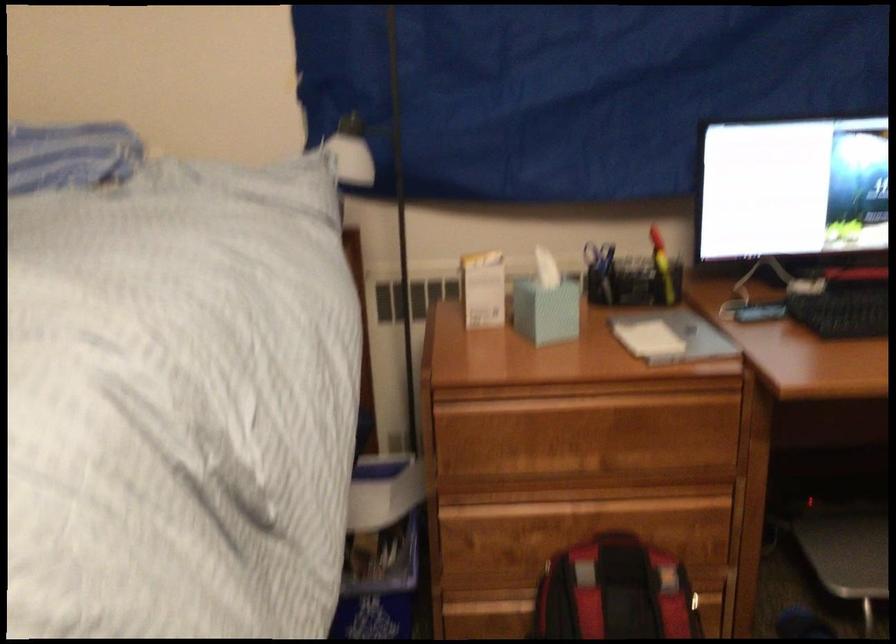
What do you see at coordinates (497, 406) in the screenshot? I see `the top drawer pull` at bounding box center [497, 406].